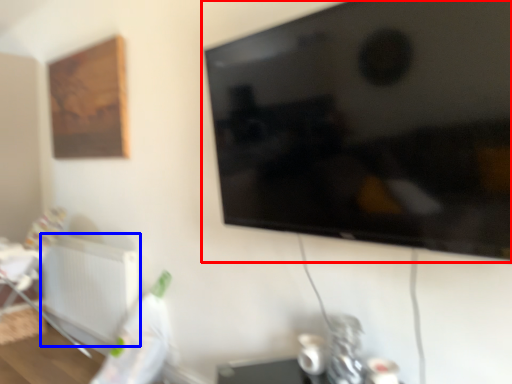
Question: Which of the following is the farthest to the observer, television (highlighted by a red box) or radiator (highlighted by a blue box)?

Choices:
 (A) television
 (B) radiator

Answer: (B)